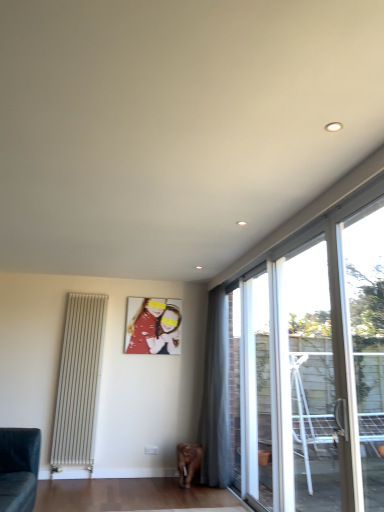
Question: Should I look upward or downward to see dark gray fabric couch at lower left?

Choices:
 (A) up
 (B) down

Answer: (B)

Question: Is transparent glass door at upper right, arranged as the 1th window when viewed from the front, oriented towards transparent glass door at right, which is the 2th window from front to back?

Choices:
 (A) no
 (B) yes

Answer: (A)

Question: Does transparent glass door at upper right, the third window from the back, lie behind transparent glass door at right, which is the 2th window from front to back?

Choices:
 (A) no
 (B) yes

Answer: (A)

Question: Considering the relative sizes of transparent glass door at upper right, arranged as the 1th window when viewed from the front, and transparent glass door at right, which is the 2th window from back to front, in the image provided, is transparent glass door at upper right, arranged as the 1th window when viewed from the front, shorter than transparent glass door at right, which is the 2th window from back to front,?

Choices:
 (A) yes
 (B) no

Answer: (A)

Question: Can you confirm if transparent glass door at upper right, arranged as the 1th window when viewed from the front, is positioned to the right of transparent glass door at right, which is the 2th window from front to back?

Choices:
 (A) no
 (B) yes

Answer: (B)

Question: Is transparent glass door at upper right, arranged as the 1th window when viewed from the front, surrounding transparent glass door at right, which is the 2th window from back to front?

Choices:
 (A) yes
 (B) no

Answer: (B)

Question: From a real-world perspective, is transparent glass door at upper right, the third window from the back, positioned over transparent glass door at right, which is the 2th window from back to front, based on gravity?

Choices:
 (A) no
 (B) yes

Answer: (B)

Question: Does dark gray fabric couch at lower left touch transparent glass door at upper right, the third window from the back?

Choices:
 (A) yes
 (B) no

Answer: (B)

Question: Can you confirm if dark gray fabric couch at lower left is smaller than transparent glass door at upper right, the third window from the back?

Choices:
 (A) no
 (B) yes

Answer: (A)

Question: Does dark gray fabric couch at lower left appear on the right side of transparent glass door at upper right, arranged as the 1th window when viewed from the front?

Choices:
 (A) yes
 (B) no

Answer: (B)

Question: From the image's perspective, is dark gray fabric couch at lower left located beneath transparent glass door at upper right, arranged as the 1th window when viewed from the front?

Choices:
 (A) no
 (B) yes

Answer: (B)

Question: Does dark gray fabric couch at lower left have a lesser width compared to transparent glass door at upper right, arranged as the 1th window when viewed from the front?

Choices:
 (A) yes
 (B) no

Answer: (B)

Question: Is the position of dark gray fabric couch at lower left more distant than that of transparent glass door at upper right, arranged as the 1th window when viewed from the front?

Choices:
 (A) yes
 (B) no

Answer: (A)

Question: From the image's perspective, is transparent glass window at right, which ranks as the first window in back-to-front order, beneath matte red photo frame at center?

Choices:
 (A) no
 (B) yes

Answer: (B)